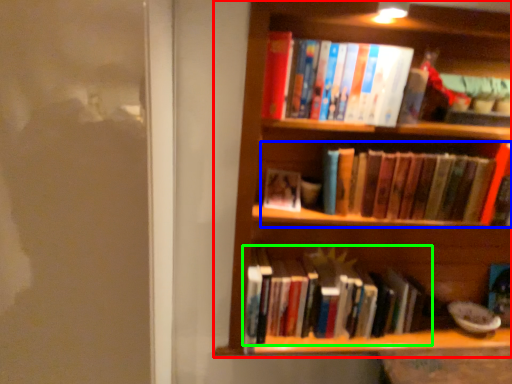
Question: Which object is positioned closest to shelf (highlighted by a red box)? Select from book (highlighted by a blue box) and book (highlighted by a green box).

Choices:
 (A) book
 (B) book

Answer: (A)